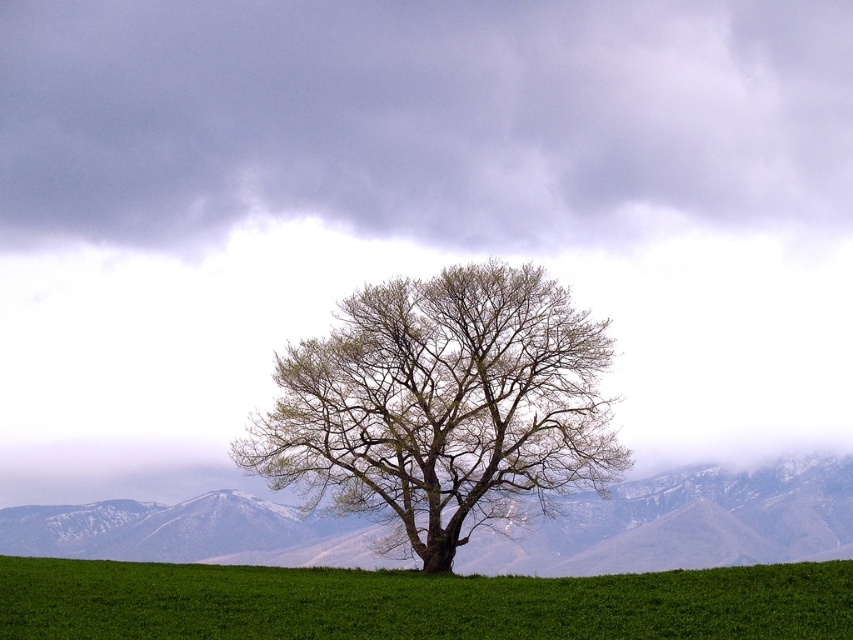
You are standing in the field and see the bare branches at center and the green grassy field at center. Which object is located to the right when facing the scene?

The bare branches at center is positioned on the right side of green grassy field at center, so the bare branches at center is located to the right when facing the scene.